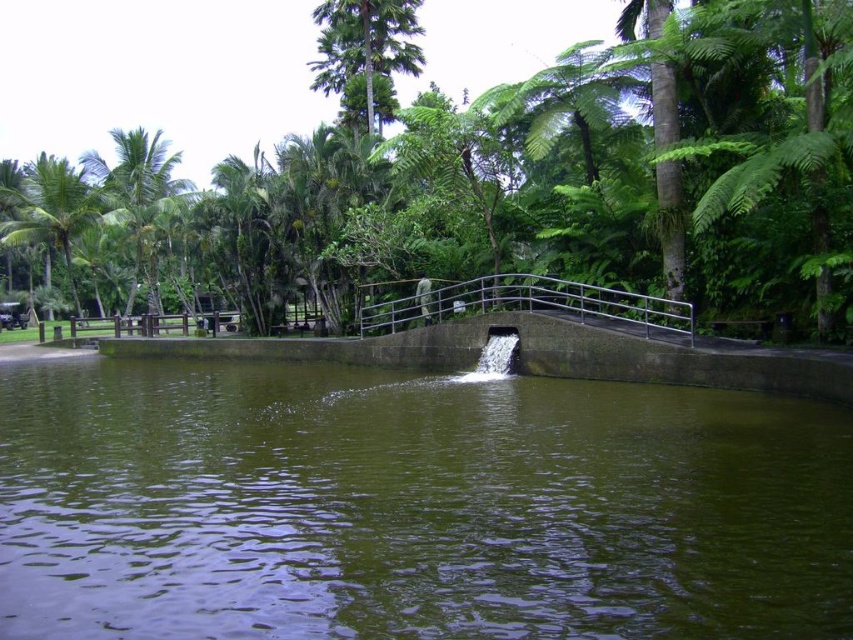
Does point (643, 83) lie in front of point (376, 316)?

Yes, it is.

The width and height of the screenshot is (853, 640). In order to click on green leafy tree at center in this screenshot , I will do `click(480, 179)`.

Is silver metallic railing at center smaller than green leafy palm tree at upper left?

Indeed, silver metallic railing at center has a smaller size compared to green leafy palm tree at upper left.

Who is positioned more to the left, silver metallic railing at center or green leafy palm tree at upper left?

green leafy palm tree at upper left

Is point (500, 300) positioned in front of point (161, 150)?

Yes, point (500, 300) is closer to viewer.

This screenshot has height=640, width=853. I want to click on silver metallic railing at center, so click(526, 304).

Who is higher up, green leafy tree at center or green leafy palm tree at upper left?

Positioned higher is green leafy tree at center.

Does point (840, 38) come behind point (173, 182)?

That is False.

Between point (804, 134) and point (119, 145), which one is positioned in front?

Positioned in front is point (804, 134).

You are a GUI agent. You are given a task and a screenshot of the screen. Output one action in this format:
    pyautogui.click(x=<x>, y=<y>)
    Task: Click on the green leafy tree at center
    The width and height of the screenshot is (853, 640).
    Given the screenshot: What is the action you would take?
    pyautogui.click(x=480, y=179)